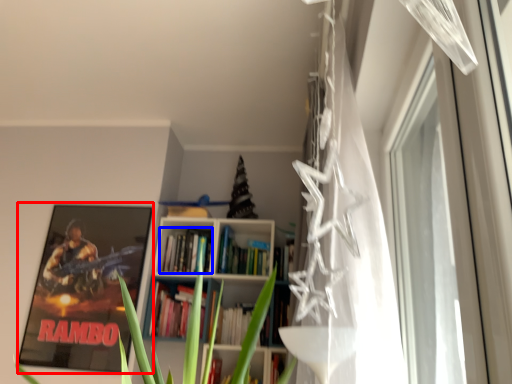
Question: Which object appears closest to the camera in this image, picture frame (highlighted by a red box) or book (highlighted by a blue box)?

Choices:
 (A) picture frame
 (B) book

Answer: (A)